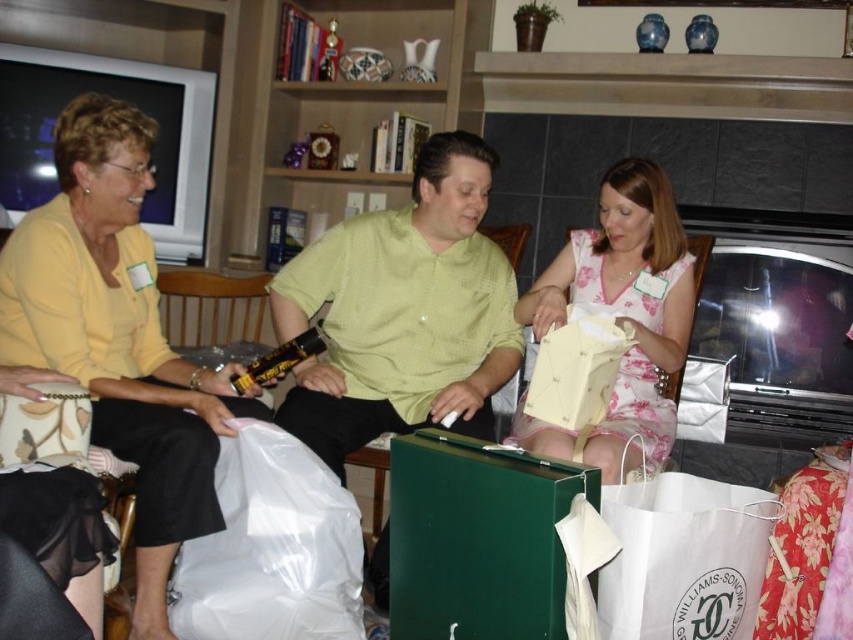
You are at a party and want to give a gift to someone. You have a gift in the transparent plastic bag at lower left. To avoid bumping into the yellow matte shirt at upper left, which direction should you move to reach the bag?

To avoid bumping into the yellow matte shirt at upper left, you should move to the right since the transparent plastic bag at lower left is to the right of the yellow matte shirt at upper left.

You are a photographer setting up for a group photo. You need to position the green textured shirt at center and the floral fabric dress at center so that both are visible in the frame. Based on their heights, which object should be placed closer to the camera to ensure their tops are equally visible?

The floral fabric dress at center should be placed closer to the camera since the green textured shirt at center is taller. This way, both will appear at a similar height in the photo.